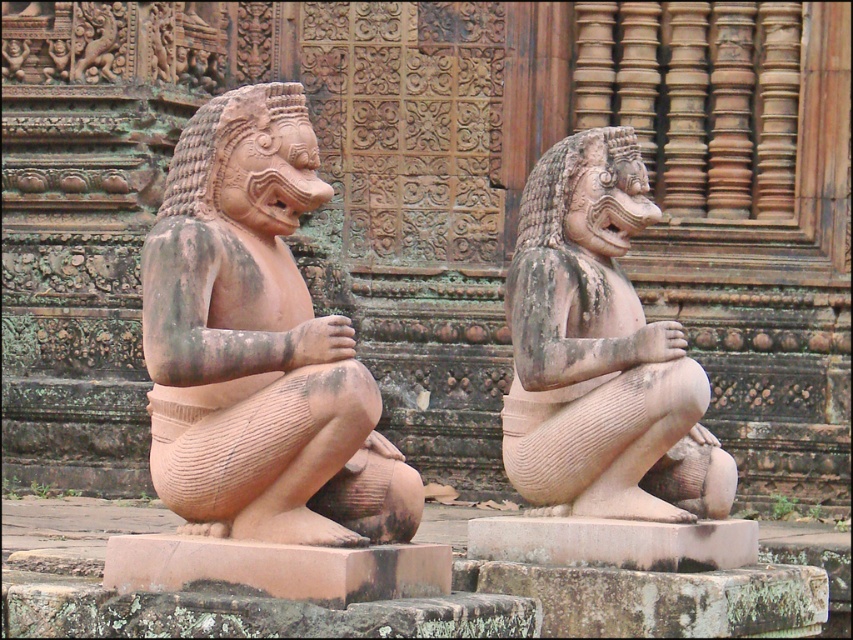
Question: Can you confirm if earthy stone statue at left is wider than matte stone statue at center?

Choices:
 (A) yes
 (B) no

Answer: (B)

Question: Can you confirm if earthy stone statue at left is smaller than matte stone statue at center?

Choices:
 (A) no
 (B) yes

Answer: (B)

Question: Which of the following is the farthest from the observer?

Choices:
 (A) (241, 168)
 (B) (695, 502)

Answer: (B)

Question: Which object is farther from the camera taking this photo?

Choices:
 (A) earthy stone statue at left
 (B) matte stone statue at center

Answer: (B)

Question: Can you confirm if earthy stone statue at left is smaller than matte stone statue at center?

Choices:
 (A) no
 (B) yes

Answer: (B)